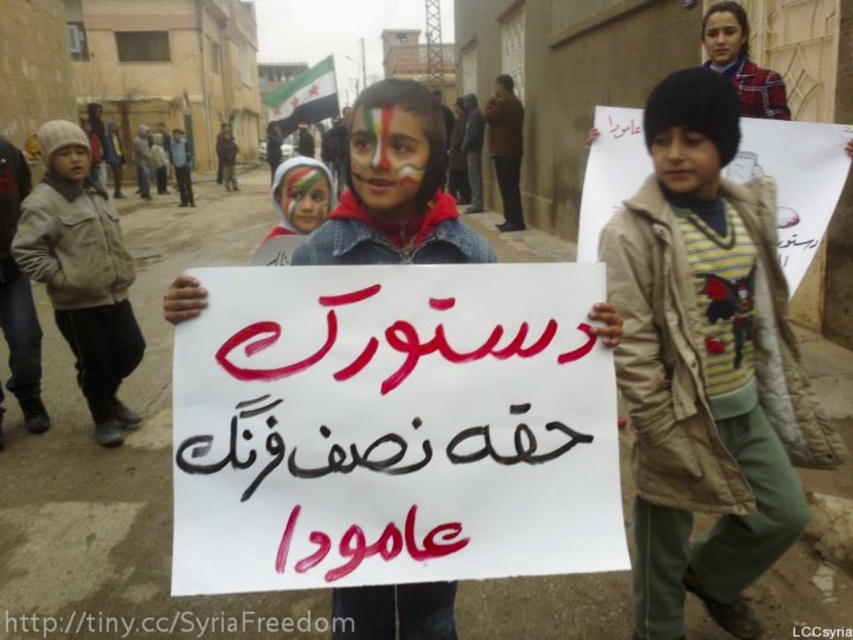
Based on the scene described, which object is smaller in size between the blackpapersign at center and the smooth skin face at upper right?

The blackpapersign at center is smaller in size compared to the smooth skin face at upper right.

Looking at the protest scene, there are two objects of interest here. The blackpapersign at center and the smooth skin face at upper right. Can you tell me which one is located lower in the image?

The blackpapersign at center is positioned under smooth skin face at upper right, so the blackpapersign at center is lower than the smooth skin face at upper right in the image.

Based on the scene description, can you determine if the white paper sign at center is wider than the matte beige jacket at lower left?

The white paper sign at center might be wider than matte beige jacket at lower left according to the description.